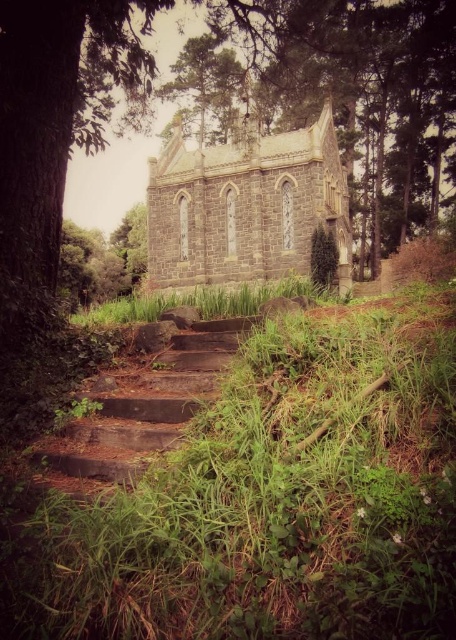
Can you confirm if green grassy steps at center is positioned to the right of green textured pine tree at upper center?

Yes, green grassy steps at center is to the right of green textured pine tree at upper center.

Is point (187, 518) more distant than point (222, 104)?

No, it is in front of (222, 104).

Is point (122, 540) positioned after point (197, 61)?

No, it is not.

Locate an element on the screen. green grassy steps at center is located at coordinates (269, 504).

The width and height of the screenshot is (456, 640). I want to click on dark gray stone church at center, so click(247, 205).

Does dark gray stone church at center have a greater height compared to green textured pine tree at upper center?

Indeed, dark gray stone church at center has a greater height compared to green textured pine tree at upper center.

Is point (342, 243) positioned after point (238, 90)?

No, (342, 243) is closer to viewer.

This screenshot has height=640, width=456. I want to click on dark gray stone church at center, so click(x=247, y=205).

Is green grassy steps at center bigger than dark gray stone church at center?

No, green grassy steps at center is not bigger than dark gray stone church at center.

Between green grassy steps at center and dark gray stone church at center, which one appears on the right side from the viewer's perspective?

green grassy steps at center is more to the right.

Is point (243, 486) positioned after point (279, 196)?

No.

The height and width of the screenshot is (640, 456). In order to click on green grassy steps at center in this screenshot , I will do `click(269, 504)`.